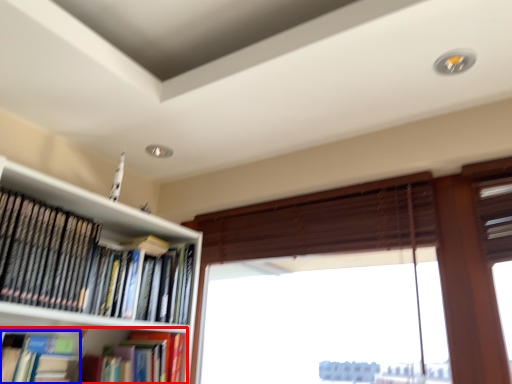
Question: Which point is further to the camera, book (highlighted by a red box) or book (highlighted by a blue box)?

Choices:
 (A) book
 (B) book

Answer: (A)